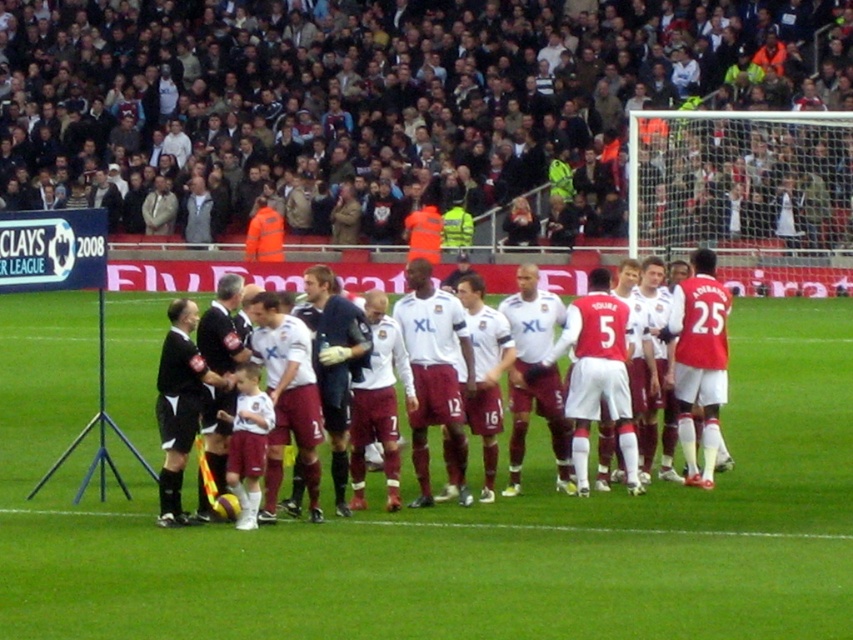
You are a photographer at the soccer match and want to capture a photo of both the brown leather jacket at upper center and the maroon jersey at center. Which object should you zoom in on to ensure both are fully visible in the frame?

The brown leather jacket at upper center is wider than the maroon jersey at center, so you should zoom in on the maroon jersey at center to ensure both fit in the frame.

You are a photographer standing at the edge of the soccer field. You want to take a photo that includes both the brown leather jacket at upper center and the black jersey at center. Given that your camera has a maximum focus range of 20 meters, will you be able to capture both subjects in focus simultaneously?

The brown leather jacket at upper center and the black jersey at center are 21.80 meters apart from each other. Since the distance between them exceeds the camera maximum focus range of 20 meters, you cannot capture both subjects in focus simultaneously.

You are a photographer positioned at the edge of the soccer field. You want to take a photo that includes both the brown leather jacket at upper center and the maroon jersey at center. Which object should you focus on first to ensure both are in sharp focus?

You should focus on the brown leather jacket at upper center first because it is closer to you than the maroon jersey at center. By focusing on the closer object, the farther one will still be in focus due to the depth of field.